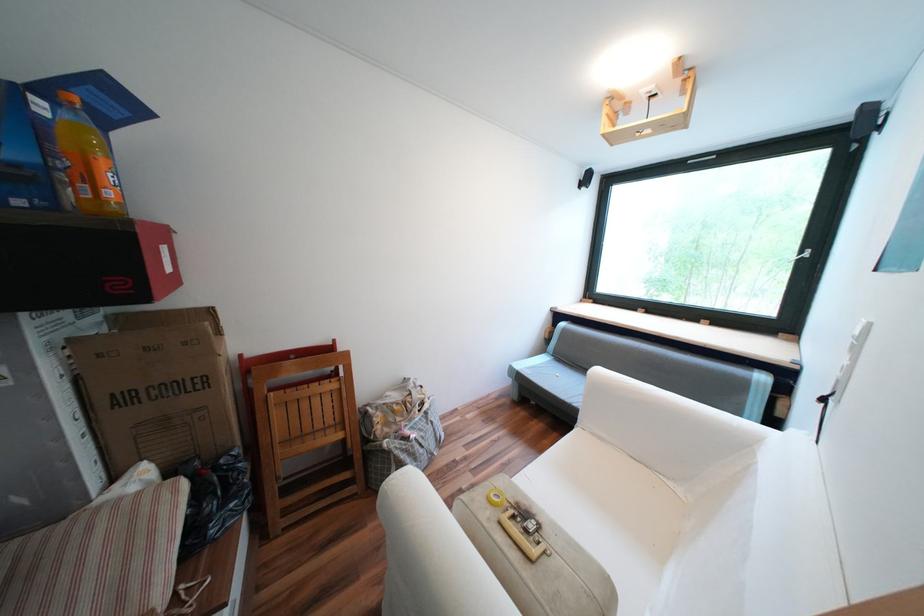
Image resolution: width=924 pixels, height=616 pixels. I want to click on grey sofa sitting surface, so click(x=554, y=379).